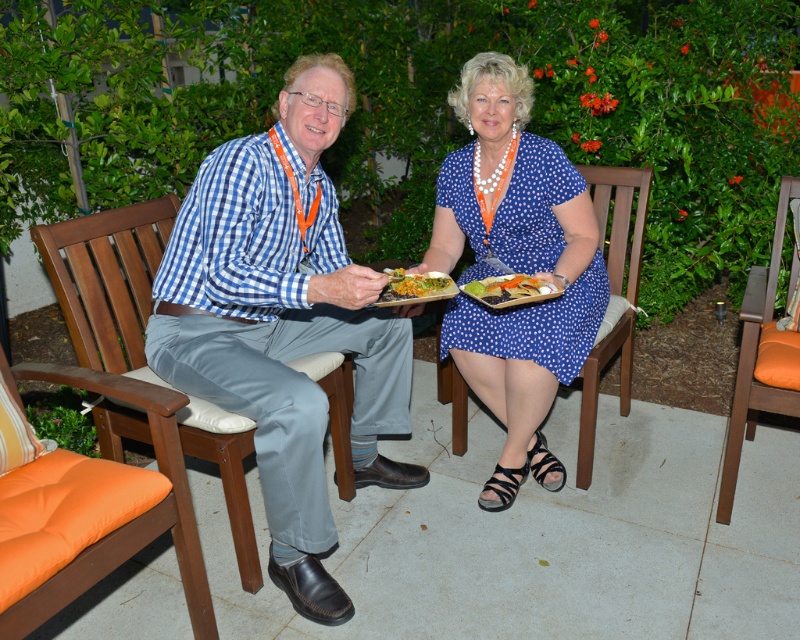
Is orange cushioned chair at lower left bigger than green leafy salad at center?

Yes, orange cushioned chair at lower left is bigger than green leafy salad at center.

Is orange cushioned chair at lower left thinner than green leafy salad at center?

No, orange cushioned chair at lower left is not thinner than green leafy salad at center.

At what (x,y) coordinates should I click in order to perform the action: click on orange cushioned chair at lower left. Please return your answer as a coordinate pair (x, y). The width and height of the screenshot is (800, 640). Looking at the image, I should click on (90, 509).

Where is `orange cushioned chair at lower left`? This screenshot has width=800, height=640. orange cushioned chair at lower left is located at coordinates (90, 509).

Is blue checkered shirt at center positioned before smooth green leaf at center?

Yes, it is in front of smooth green leaf at center.

Does blue checkered shirt at center have a lesser height compared to smooth green leaf at center?

No, blue checkered shirt at center is not shorter than smooth green leaf at center.

At what (x,y) coordinates should I click in order to perform the action: click on blue checkered shirt at center. Please return your answer as a coordinate pair (x, y). The width and height of the screenshot is (800, 640). Looking at the image, I should click on (284, 323).

Does blue dotted dress at center appear on the right side of orange cushioned chair at lower left?

Yes, blue dotted dress at center is to the right of orange cushioned chair at lower left.

Who is positioned more to the left, blue dotted dress at center or orange cushioned chair at lower left?

From the viewer's perspective, orange cushioned chair at lower left appears more on the left side.

Does point (488, 316) lie in front of point (10, 497)?

That is False.

Locate an element on the screen. The width and height of the screenshot is (800, 640). blue dotted dress at center is located at coordinates (516, 266).